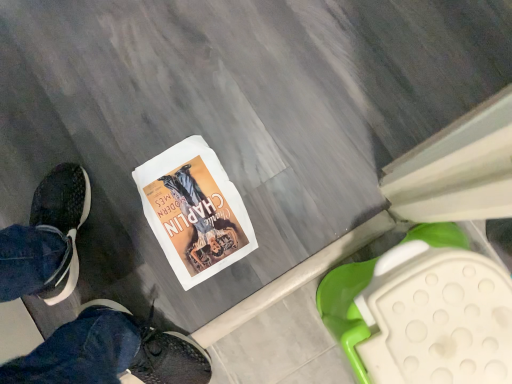
At what (x,y) coordinates should I click in order to perform the action: click on vacant space behind white paper comic book at center. Please return your answer as a coordinate pair (x, y). Image resolution: width=512 pixels, height=384 pixels. Looking at the image, I should click on (134, 135).